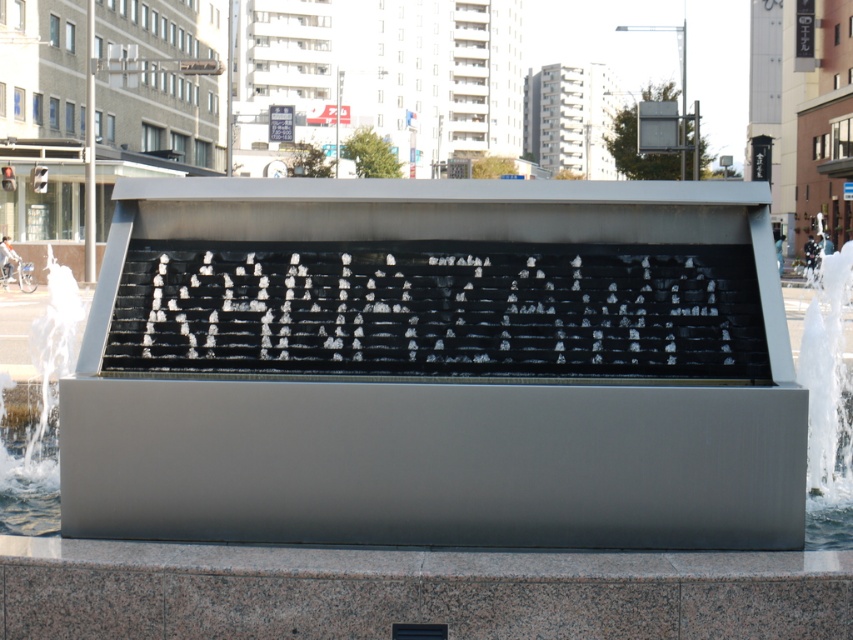
Question: Does satin silver fountain at center appear on the right side of clear water at fountain left?

Choices:
 (A) yes
 (B) no

Answer: (A)

Question: Does satin silver fountain at center have a greater width compared to clear water at fountain left?

Choices:
 (A) no
 (B) yes

Answer: (A)

Question: Is satin silver fountain at center below clear water at fountain left?

Choices:
 (A) no
 (B) yes

Answer: (B)

Question: Which point appears closest to the camera in this image?

Choices:
 (A) (28, 449)
 (B) (720, 545)

Answer: (B)

Question: Which of the following is the farthest from the observer?

Choices:
 (A) clear water at fountain left
 (B) satin silver fountain at center

Answer: (A)